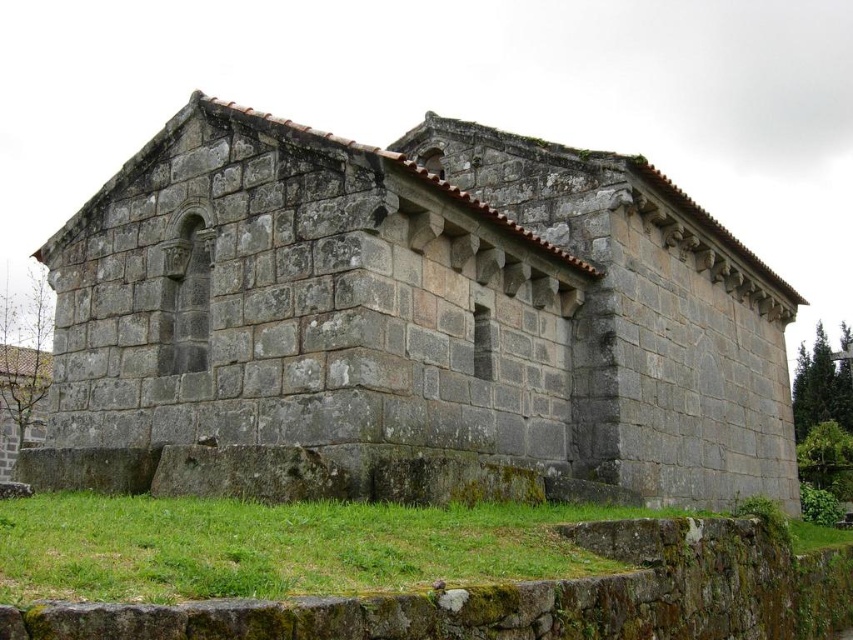
Where is `gray stone church at center`? gray stone church at center is located at coordinates (421, 307).

Where is `gray stone church at center`? The width and height of the screenshot is (853, 640). gray stone church at center is located at coordinates (421, 307).